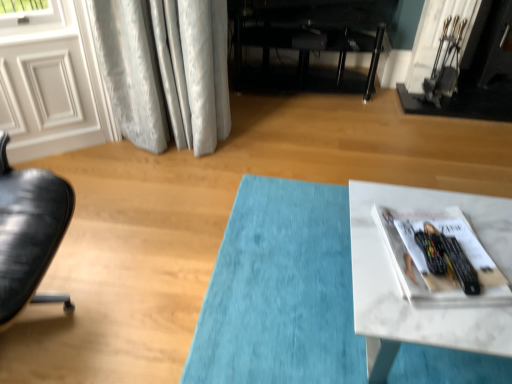
The image size is (512, 384). What are the coordinates of `vacant space positioned to the left of white glossy magazine at lower right` in the screenshot? It's located at (366, 259).